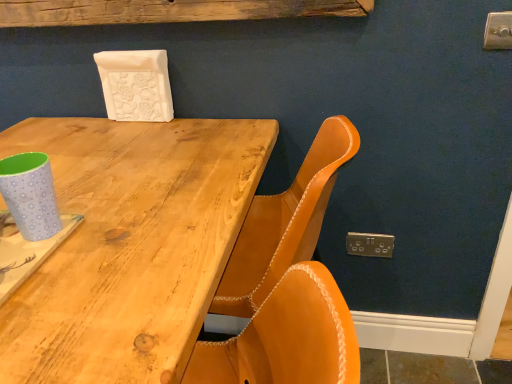
Find the location of a particular element. This screenshot has height=384, width=512. free point behind light blue polka dot paper cup at left is located at coordinates [89, 190].